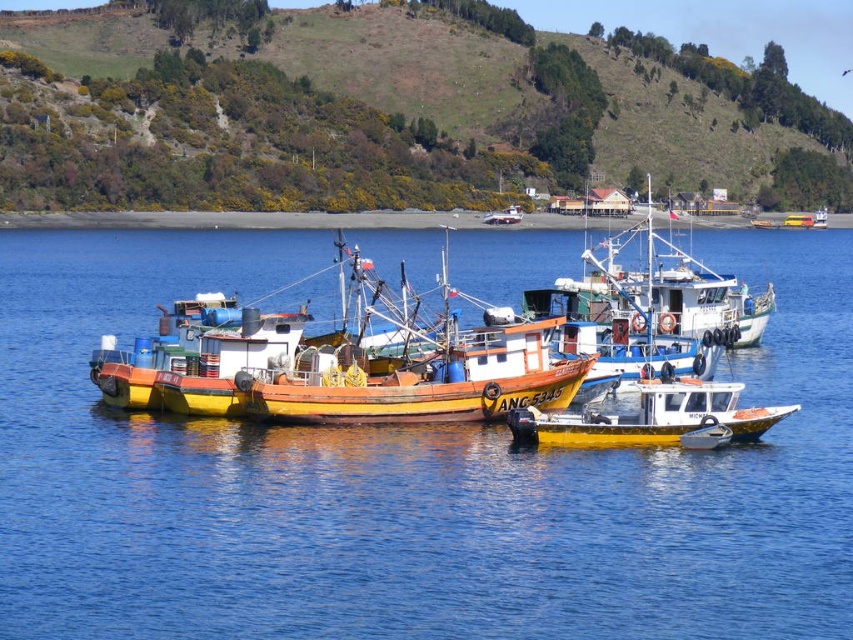
Question: Does blue water at center come in front of green grassy hillside at upper center?

Choices:
 (A) yes
 (B) no

Answer: (A)

Question: Which of the following is the farthest from the observer?

Choices:
 (A) green grassy hillside at upper center
 (B) yellow matte boat at center

Answer: (A)

Question: Can you confirm if blue water at center is positioned below yellow matte boat at center?

Choices:
 (A) no
 (B) yes

Answer: (A)

Question: Does blue water at center appear over yellow matte boat at center?

Choices:
 (A) no
 (B) yes

Answer: (B)

Question: Which object appears farthest from the camera in this image?

Choices:
 (A) green grassy hillside at upper center
 (B) blue water at center

Answer: (A)

Question: Among these points, which one is farthest from the camera?

Choices:
 (A) click(x=457, y=20)
 (B) click(x=700, y=237)

Answer: (A)